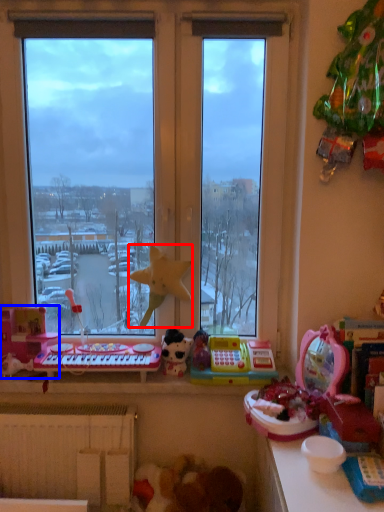
Question: Which point is further to the camera, toy (highlighted by a red box) or toy (highlighted by a blue box)?

Choices:
 (A) toy
 (B) toy

Answer: (B)